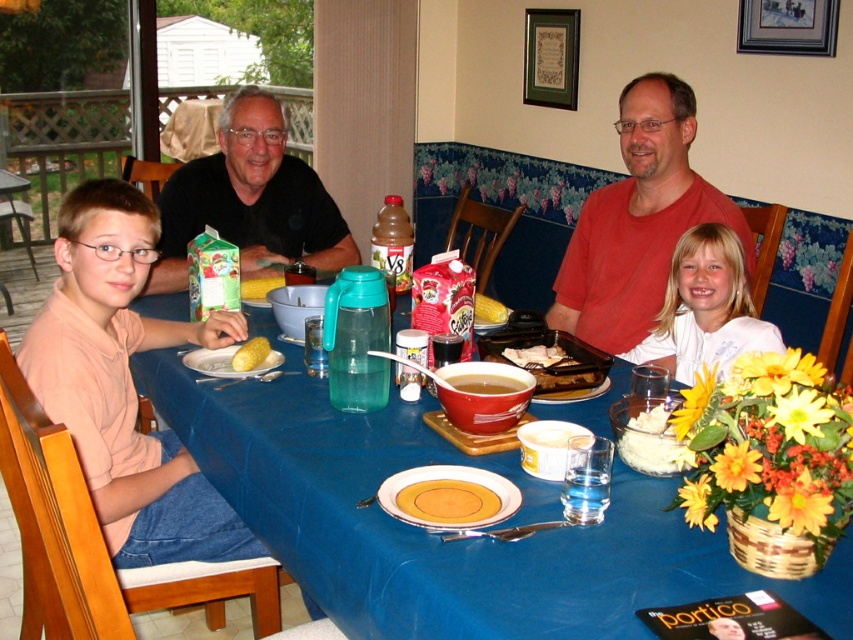
Question: Does black matte shirt at upper left have a larger size compared to orange plate at center?

Choices:
 (A) yes
 (B) no

Answer: (A)

Question: Which object is the farthest from the black matte shirt at upper left?

Choices:
 (A) light pink shirt at left
 (B) yellow corn at center

Answer: (B)

Question: Which point is closer to the camera?

Choices:
 (A) red matte shirt at upper right
 (B) brown crispy chicken at center

Answer: (B)

Question: From the image, what is the correct spatial relationship of blue fabric table at center in relation to yellow corn at table center?

Choices:
 (A) left
 (B) right

Answer: (B)

Question: Which object appears farthest from the camera in this image?

Choices:
 (A) yellow corn at table center
 (B) white matte shirt at upper right
 (C) blue fabric table at center
 (D) yellow matte corn at table center

Answer: (A)

Question: Is the position of brown matte bowl at center more distant than that of yellow corn at center?

Choices:
 (A) yes
 (B) no

Answer: (B)